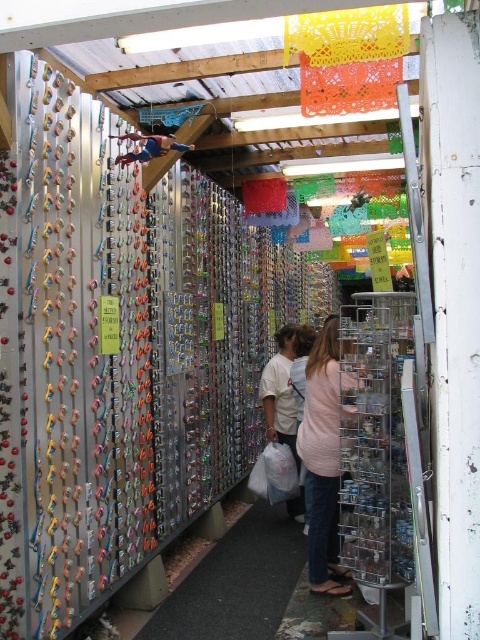
Who is taller, pink fabric shirt at center or white matte plastic bag at center?

Standing taller between the two is pink fabric shirt at center.

Can you confirm if pink fabric shirt at center is positioned to the right of white matte plastic bag at center?

Correct, you'll find pink fabric shirt at center to the right of white matte plastic bag at center.

The width and height of the screenshot is (480, 640). Identify the location of pink fabric shirt at center. (323, 460).

Is pink fabric shirt at center smaller than blue fabric at upper center?

No.

Is pink fabric shirt at center taller than blue fabric at upper center?

Correct, pink fabric shirt at center is much taller as blue fabric at upper center.

The image size is (480, 640). I want to click on pink fabric shirt at center, so click(323, 460).

Identify the location of pink fabric shirt at center. (323, 460).

Is point (276, 364) more distant than point (123, 134)?

Yes.

Is the position of white matte plastic bag at center less distant than that of blue fabric at upper center?

No.

Is point (298, 497) farther from camera compared to point (154, 152)?

Yes, point (298, 497) is behind point (154, 152).

Locate an element on the screen. Image resolution: width=480 pixels, height=640 pixels. white matte plastic bag at center is located at coordinates (279, 392).